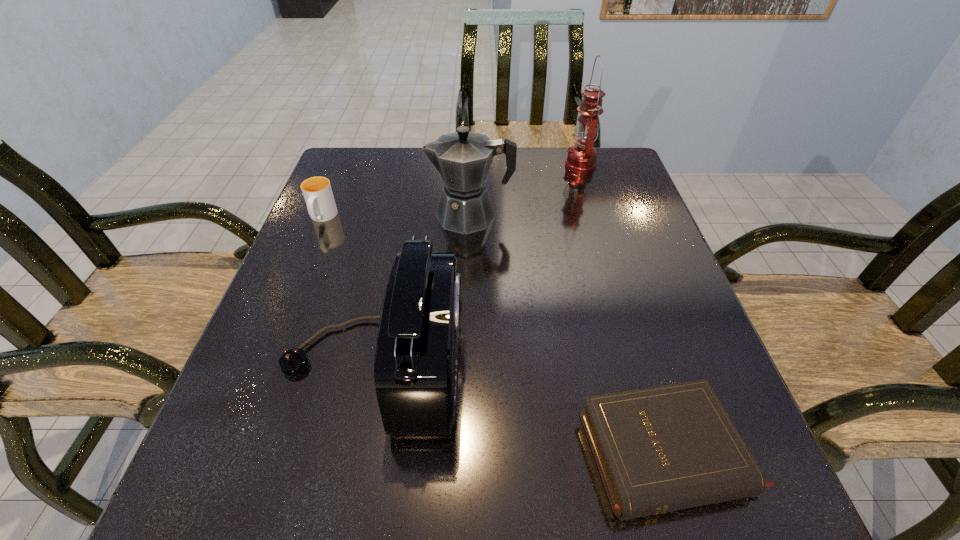
Locate an element on the screen. object that is positioned at the far right corner is located at coordinates (581, 158).

You are a GUI agent. You are given a task and a screenshot of the screen. Output one action in this format:
    pyautogui.click(x=<x>, y=<y>)
    Task: Click on the object that is positioned at the near right corner
    This screenshot has width=960, height=540.
    Given the screenshot: What is the action you would take?
    pyautogui.click(x=660, y=449)

The width and height of the screenshot is (960, 540). I want to click on vacant space at the far edge of the desktop, so click(x=534, y=158).

What are the coordinates of `vacant space at the near edge of the desktop` in the screenshot? It's located at (534, 531).

You are a GUI agent. You are given a task and a screenshot of the screen. Output one action in this format:
    pyautogui.click(x=<x>, y=<y>)
    Task: Click on the blank space at the left edge of the desktop
    This screenshot has height=540, width=960.
    Given the screenshot: What is the action you would take?
    pyautogui.click(x=267, y=404)

Find the location of a particular element. vacant space at the right edge of the desktop is located at coordinates click(626, 239).

Locate an element on the screen. vacant space at the near left corner is located at coordinates (226, 474).

In the image, there is a desktop. Identify the location of vacant space at the far right corner. (597, 173).

Identify the location of free space between the Bible and the second shortest object. The width and height of the screenshot is (960, 540). [x=495, y=336].

I want to click on free point between the tallest object and the coffeepot, so click(525, 190).